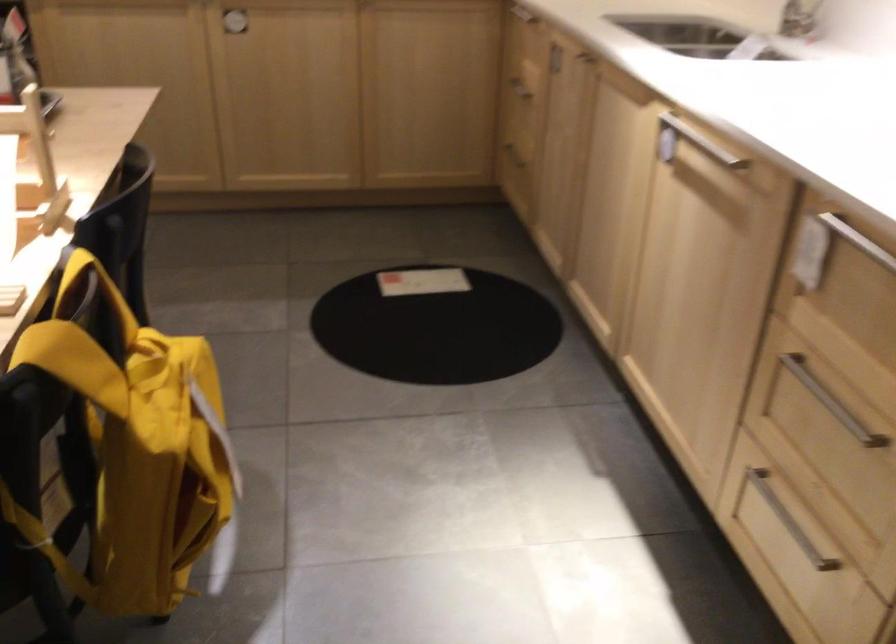
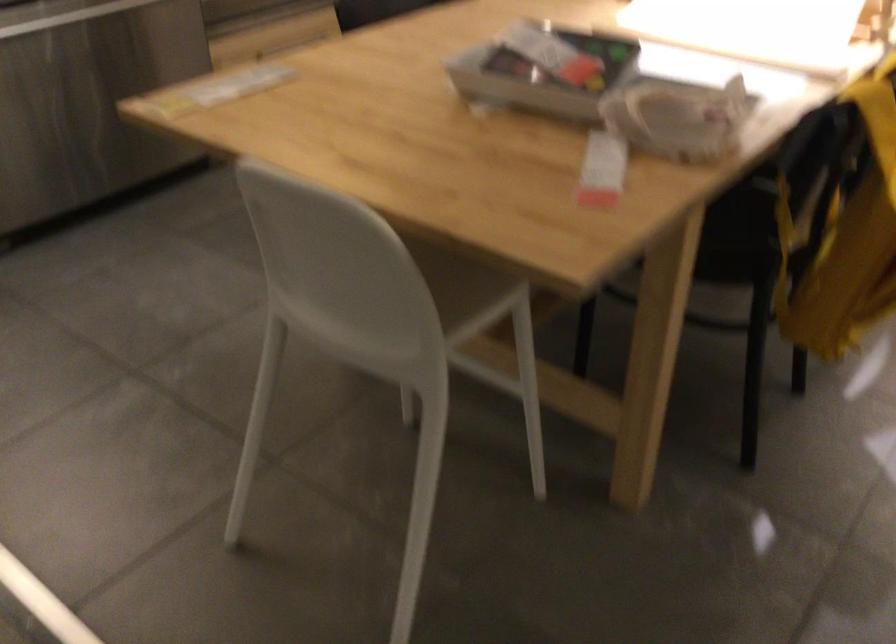
Question: Based on the continuous images, in which direction is the camera rotating? Reply with the corresponding letter.

Choices:
 (A) Left
 (B) Right
 (C) Up
 (D) Down

Answer: (A)